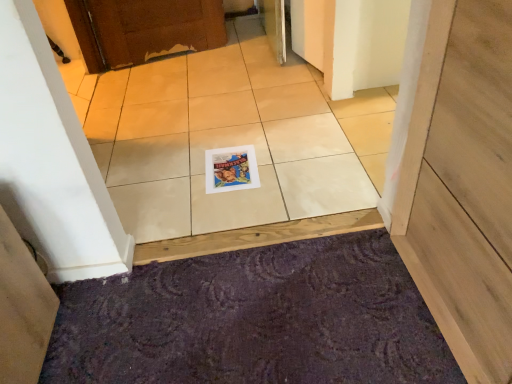
Identify the location of matte paper magazine at center. This screenshot has width=512, height=384. (231, 169).

Where is `purple textured doormat at lower center`? The width and height of the screenshot is (512, 384). purple textured doormat at lower center is located at coordinates (254, 320).

Locate an element on the screen. Image resolution: width=512 pixels, height=384 pixels. matte paper magazine at center is located at coordinates (231, 169).

Which object is wider, matte paper magazine at center or white glossy tile at center?

With larger width is white glossy tile at center.

Is matte paper magazine at center taller or shorter than white glossy tile at center?

Clearly, matte paper magazine at center is taller compared to white glossy tile at center.

Which is correct: matte paper magazine at center is inside white glossy tile at center, or outside of it?

The correct answer is: inside.

From a real-world perspective, between matte paper magazine at center and white glossy tile at center, who is vertically higher?

From a 3D spatial view, white glossy tile at center is above.

There is a purple textured doormat at lower center. At what (x,y) coordinates should I click in order to perform the action: click on magazine above it (from a real-world perspective). Please return your answer as a coordinate pair (x, y). This screenshot has height=384, width=512. Looking at the image, I should click on (231, 169).

From the image's perspective, which one is positioned higher, matte paper magazine at center or purple textured doormat at lower center?

matte paper magazine at center, from the image's perspective.

Who is shorter, matte paper magazine at center or purple textured doormat at lower center?

Standing shorter between the two is matte paper magazine at center.

Considering the relative positions of white glossy tile at center and matte paper magazine at center in the image provided, is white glossy tile at center to the left or to the right of matte paper magazine at center?

Based on their positions, white glossy tile at center is located to the left of matte paper magazine at center.

There is a matte paper magazine at center. What are the coordinates of `ceramic tile above it (from a real-world perspective)` in the screenshot? It's located at (230, 139).

Considering the relative sizes of white glossy tile at center and matte paper magazine at center in the image provided, is white glossy tile at center wider than matte paper magazine at center?

Indeed, white glossy tile at center has a greater width compared to matte paper magazine at center.

Which is further, (173, 321) or (247, 151)?

Positioned behind is point (247, 151).

Consider the image. Measure the distance from purple textured doormat at lower center to matte paper magazine at center.

55.42 centimeters.

Which is in front, purple textured doormat at lower center or matte paper magazine at center?

purple textured doormat at lower center is closer to the camera.

You are a GUI agent. You are given a task and a screenshot of the screen. Output one action in this format:
    pyautogui.click(x=<x>, y=<y>)
    Task: Click on the magazine behind the purple textured doormat at lower center
    The height and width of the screenshot is (384, 512).
    Given the screenshot: What is the action you would take?
    pyautogui.click(x=231, y=169)

In terms of size, does purple textured doormat at lower center appear bigger or smaller than white glossy tile at center?

purple textured doormat at lower center is smaller than white glossy tile at center.

Is purple textured doormat at lower center not close to white glossy tile at center?

No, purple textured doormat at lower center is not far from white glossy tile at center.

From the image's perspective, is purple textured doormat at lower center located above white glossy tile at center?

No.

How different are the orientations of purple textured doormat at lower center and white glossy tile at center in degrees?

They differ by 180 degrees in their facing directions.

Consider the image. Considering the sizes of white glossy tile at center and purple textured doormat at lower center in the image, is white glossy tile at center taller or shorter than purple textured doormat at lower center?

white glossy tile at center is shorter than purple textured doormat at lower center.

Is point (145, 102) closer or farther from the camera than point (382, 277)?

Point (145, 102) is positioned farther from the camera compared to point (382, 277).

Between white glossy tile at center and purple textured doormat at lower center, which one has larger size?

white glossy tile at center is bigger.

In the scene shown: Which of these two, white glossy tile at center or purple textured doormat at lower center, is thinner?

Thinner between the two is purple textured doormat at lower center.

Image resolution: width=512 pixels, height=384 pixels. I want to click on ceramic tile that is on the left side of matte paper magazine at center, so click(x=230, y=139).

Find the location of a particular element. The image size is (512, 384). doormat in front of the matte paper magazine at center is located at coordinates [x=254, y=320].

Considering their positions, is white glossy tile at center positioned further to matte paper magazine at center than purple textured doormat at lower center?

purple textured doormat at lower center lies further to matte paper magazine at center than the other object.

Which object lies nearer to the anchor point matte paper magazine at center, purple textured doormat at lower center or white glossy tile at center?

white glossy tile at center is closer to matte paper magazine at center.

From the image, which object appears to be nearer to purple textured doormat at lower center, white glossy tile at center or matte paper magazine at center?

matte paper magazine at center.

Considering their positions, is matte paper magazine at center positioned closer to white glossy tile at center than purple textured doormat at lower center?

matte paper magazine at center.

Based on their spatial positions, is purple textured doormat at lower center or matte paper magazine at center closer to white glossy tile at center?

matte paper magazine at center is closer to white glossy tile at center.

Estimate the real-world distances between objects in this image. Which object is further from purple textured doormat at lower center, matte paper magazine at center or white glossy tile at center?

The object further to purple textured doormat at lower center is white glossy tile at center.

Find the location of a particular element. magazine between white glossy tile at center and purple textured doormat at lower center from top to bottom is located at coordinates (231, 169).